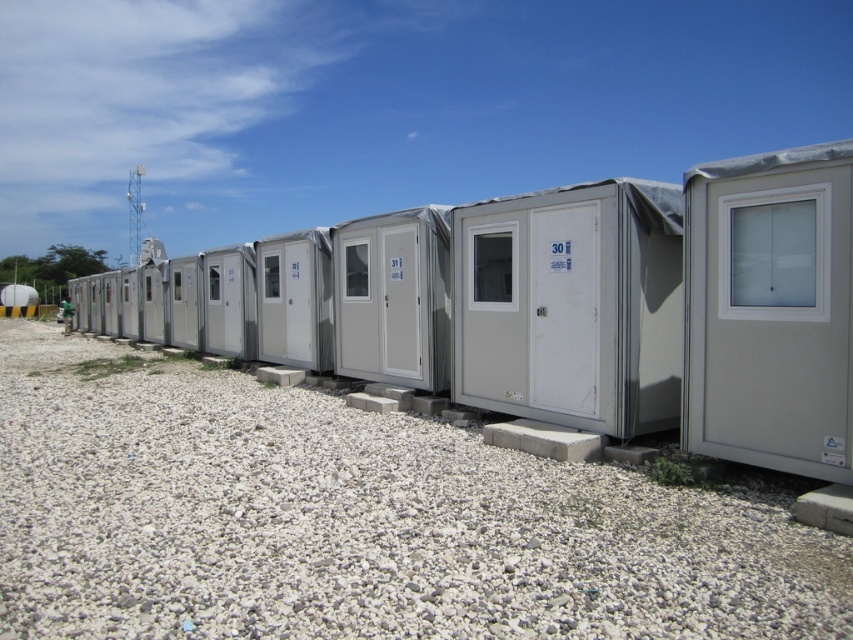
Is white gravel at lower center positioned behind matte gray container at center?

No, white gravel at lower center is in front of matte gray container at center.

Is white gravel at lower center below matte gray container at center?

Yes.

Is point (711, 595) positioned before point (561, 346)?

That is True.

Image resolution: width=853 pixels, height=640 pixels. Identify the location of white gravel at lower center. (355, 520).